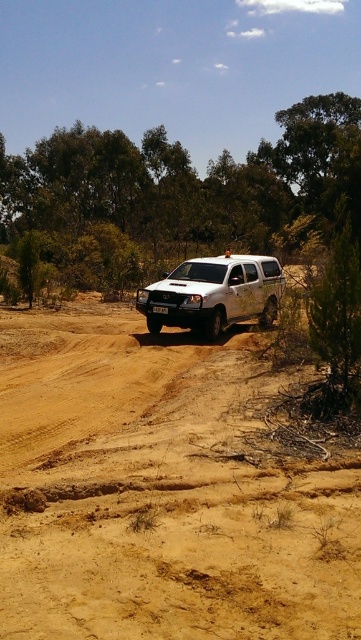
Question: Which is nearer to the white matte suv at center?

Choices:
 (A) brown sandy terrain at center
 (B) green leafy tree at center

Answer: (A)

Question: In this image, where is brown sandy terrain at center located relative to white matte suv at center?

Choices:
 (A) above
 (B) below

Answer: (B)

Question: Which of the following is the farthest from the observer?

Choices:
 (A) (320, 525)
 (B) (197, 300)

Answer: (B)

Question: Observing the image, what is the correct spatial positioning of green leafy tree at center in reference to white matte suv at center?

Choices:
 (A) left
 (B) right

Answer: (A)

Question: Which object appears farthest from the camera in this image?

Choices:
 (A) white matte suv at center
 (B) green leafy tree at center

Answer: (A)

Question: Does brown sandy terrain at center have a larger size compared to green leafy tree at center?

Choices:
 (A) yes
 (B) no

Answer: (B)